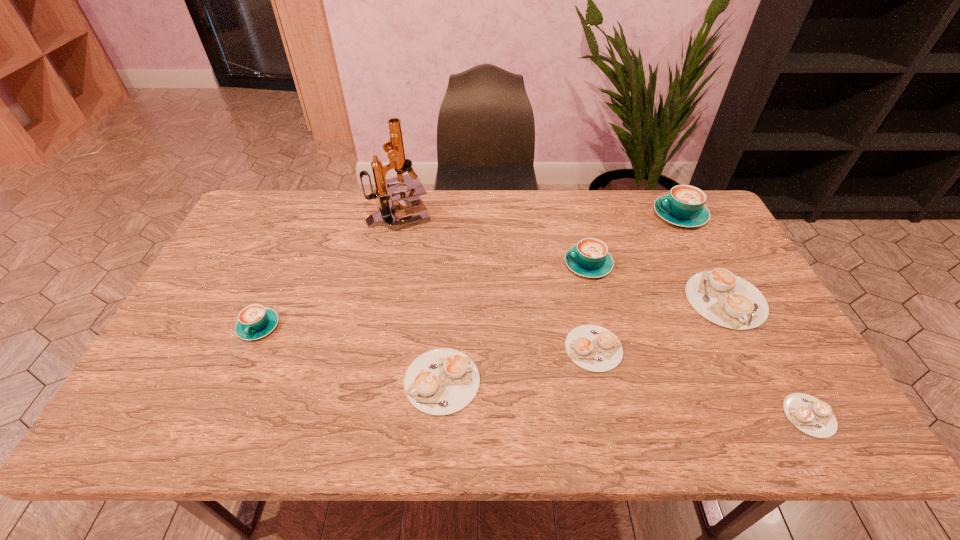
This screenshot has width=960, height=540. In order to click on free space that is in between the fifth tallest object and the fifth shortest object in this screenshot , I will do `click(492, 313)`.

Where is `free space between the second turquoise cappuccino from right to left and the third tallest cappuccino`? This screenshot has height=540, width=960. free space between the second turquoise cappuccino from right to left and the third tallest cappuccino is located at coordinates (423, 296).

The width and height of the screenshot is (960, 540). Identify the location of free space between the sixth shortest object and the smallest white cappuccino. (699, 340).

Image resolution: width=960 pixels, height=540 pixels. I want to click on vacant area that lies between the shortest object and the gold microscope, so click(x=604, y=315).

Locate an element on the screen. The image size is (960, 540). free space that is in between the shortest object and the biggest white cappuccino is located at coordinates (767, 357).

The height and width of the screenshot is (540, 960). What are the coordinates of `free spot between the nearest turquoise cappuccino and the farthest turquoise cappuccino` in the screenshot? It's located at (469, 271).

Where is `free area in between the sixth shortest object and the second shortest object`? free area in between the sixth shortest object and the second shortest object is located at coordinates (590, 307).

This screenshot has width=960, height=540. Find the location of `object that is the third closest to the farthest turquoise cappuccino`. object that is the third closest to the farthest turquoise cappuccino is located at coordinates (594, 348).

Identify the location of object that stands as the second closest to the second biggest turquoise cappuccino. (721, 297).

Select which cappuccino appears as the second closest to the biggest turquoise cappuccino. Please provide its 2D coordinates. Your answer should be formatted as a tuple, i.e. [(x, y)], where the tuple contains the x and y coordinates of a point satisfying the conditions above.

[(589, 258)]